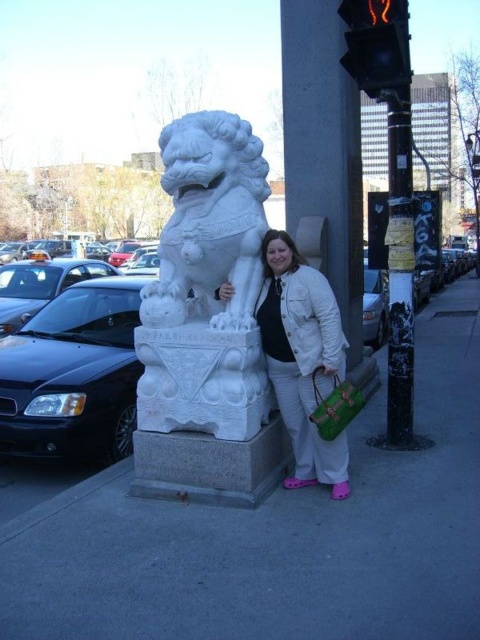
Question: Which object is farther from the camera taking this photo?

Choices:
 (A) black painted metal pole at right
 (B) brushed metal lamp post at upper right
 (C) white matte jacket at center

Answer: (B)

Question: Among these objects, which one is nearest to the camera?

Choices:
 (A) white stone statue at center
 (B) white matte jacket at center

Answer: (A)

Question: Where is white matte jacket at center located in relation to black painted metal pole at right in the image?

Choices:
 (A) above
 (B) below

Answer: (B)

Question: Which object is closer to the camera taking this photo?

Choices:
 (A) white stone pillar at center
 (B) white matte jacket at center

Answer: (B)

Question: Is white stone statue at center wider than white stone pillar at center?

Choices:
 (A) yes
 (B) no

Answer: (A)

Question: Is white marble lion at center further to the viewer compared to black painted metal pole at right?

Choices:
 (A) yes
 (B) no

Answer: (B)